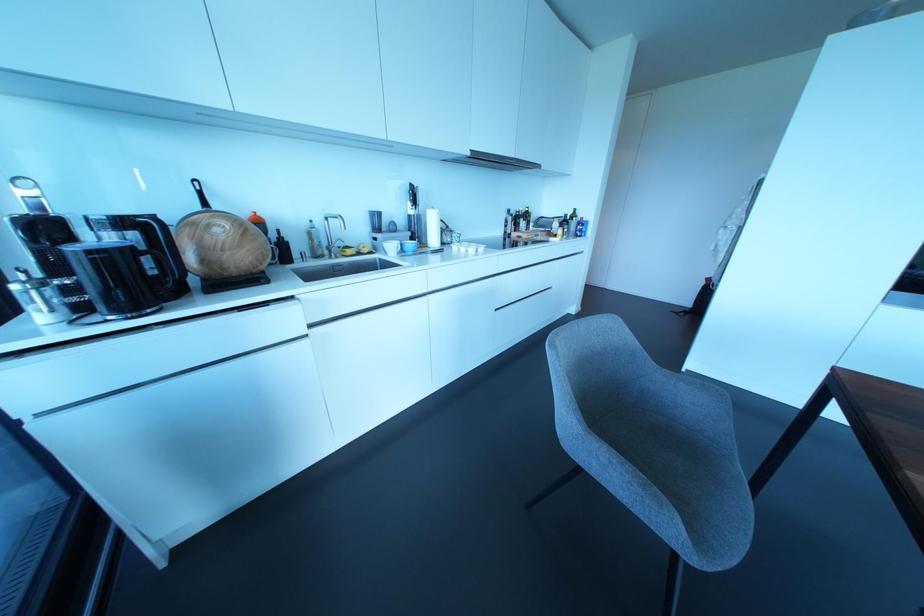
Find the location of a particular element. The width and height of the screenshot is (924, 616). faucet handle is located at coordinates (334, 241).